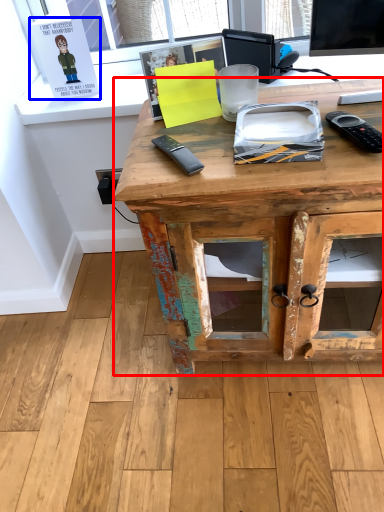
Question: Which of the following is the closest to the observer, desk (highlighted by a red box) or book (highlighted by a blue box)?

Choices:
 (A) desk
 (B) book

Answer: (A)